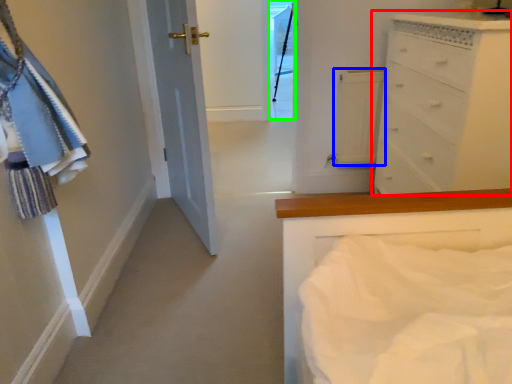
Question: Based on their relative distances, which object is farther from chest of drawers (highlighted by a red box)? Choose from cabinetry (highlighted by a blue box) and glass door (highlighted by a green box).

Choices:
 (A) cabinetry
 (B) glass door

Answer: (B)